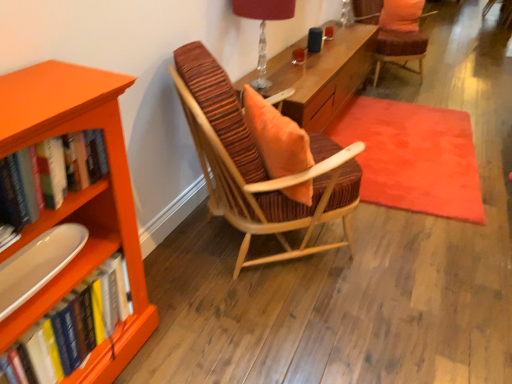
Question: Are velvet orange rug at center and matte white tray at lower left far apart?

Choices:
 (A) no
 (B) yes

Answer: (B)

Question: Is velvet orange rug at center to the right of matte white tray at lower left from the viewer's perspective?

Choices:
 (A) yes
 (B) no

Answer: (A)

Question: Can you confirm if velvet orange rug at center is thinner than matte white tray at lower left?

Choices:
 (A) yes
 (B) no

Answer: (B)

Question: Does velvet orange rug at center contain matte white tray at lower left?

Choices:
 (A) no
 (B) yes

Answer: (A)

Question: Considering the relative sizes of velvet orange rug at center and matte white tray at lower left in the image provided, is velvet orange rug at center shorter than matte white tray at lower left?

Choices:
 (A) no
 (B) yes

Answer: (B)

Question: Considering the relative sizes of velvet orange rug at center and matte white tray at lower left in the image provided, is velvet orange rug at center wider than matte white tray at lower left?

Choices:
 (A) no
 (B) yes

Answer: (B)

Question: Considering the relative sizes of hardcover books at left, which ranks as the 2th book in top-to-bottom order, and hardcover books at left, positioned as the 1th book in top-to-bottom order, in the image provided, is hardcover books at left, which ranks as the 2th book in top-to-bottom order, smaller than hardcover books at left, positioned as the 1th book in top-to-bottom order,?

Choices:
 (A) no
 (B) yes

Answer: (A)

Question: Is hardcover books at left, acting as the 1th book starting from the bottom, oriented towards hardcover books at left, the second book in the bottom-to-top sequence?

Choices:
 (A) no
 (B) yes

Answer: (A)

Question: From the image's perspective, is hardcover books at left, which ranks as the 2th book in top-to-bottom order, beneath hardcover books at left, positioned as the 1th book in top-to-bottom order?

Choices:
 (A) no
 (B) yes

Answer: (B)

Question: Does hardcover books at left, which ranks as the 2th book in top-to-bottom order, come behind hardcover books at left, positioned as the 1th book in top-to-bottom order?

Choices:
 (A) no
 (B) yes

Answer: (B)

Question: Can we say hardcover books at left, which ranks as the 2th book in top-to-bottom order, lies outside hardcover books at left, positioned as the 1th book in top-to-bottom order?

Choices:
 (A) no
 (B) yes

Answer: (B)

Question: From a real-world perspective, is hardcover books at left, acting as the 1th book starting from the bottom, located beneath hardcover books at left, the second book in the bottom-to-top sequence?

Choices:
 (A) yes
 (B) no

Answer: (A)

Question: From the image's perspective, is matte white tray at lower left above translucent glass table lamp at upper center?

Choices:
 (A) yes
 (B) no

Answer: (B)